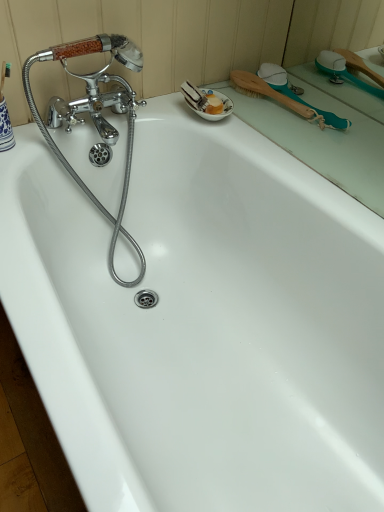
Question: In terms of width, does teal rubber shower brush at upper right look wider or thinner when compared to teal plastic brush at upper right?

Choices:
 (A) wide
 (B) thin

Answer: (A)

Question: Considering their positions, is teal rubber shower brush at upper right located in front of or behind teal plastic brush at upper right?

Choices:
 (A) front
 (B) behind

Answer: (B)

Question: Which is correct: teal rubber shower brush at upper right is inside teal plastic brush at upper right, or outside of it?

Choices:
 (A) inside
 (B) outside

Answer: (B)

Question: From their relative heights in the image, would you say teal plastic brush at upper right is taller or shorter than teal rubber shower brush at upper right?

Choices:
 (A) tall
 (B) short

Answer: (B)

Question: Considering their positions, is teal plastic brush at upper right located in front of or behind teal rubber shower brush at upper right?

Choices:
 (A) front
 (B) behind

Answer: (A)

Question: Would you say teal plastic brush at upper right is inside or outside teal rubber shower brush at upper right?

Choices:
 (A) inside
 (B) outside

Answer: (B)

Question: Is point (327, 174) closer or farther from the camera than point (340, 126)?

Choices:
 (A) farther
 (B) closer

Answer: (B)